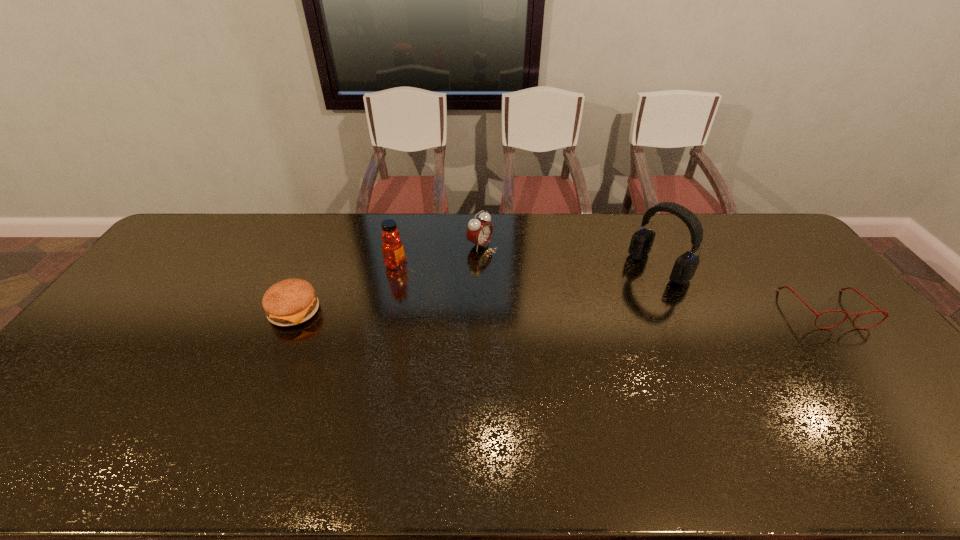
This screenshot has width=960, height=540. In order to click on free space that satisfies the following two spatial constraints: 1. on the back side of the second object from left to right; 2. on the right side of the third tallest object in this screenshot , I will do `click(399, 245)`.